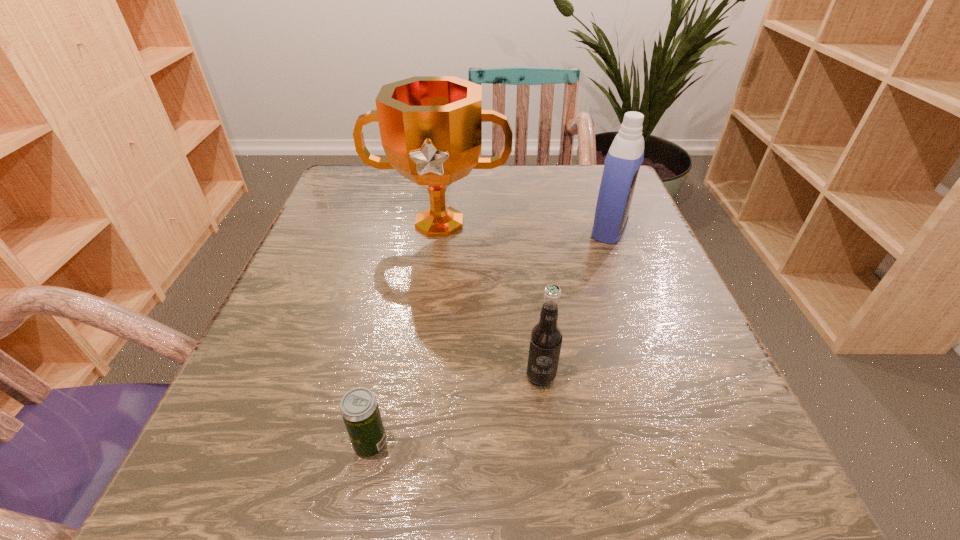
Locate an element on the screen. award is located at coordinates [431, 126].

The image size is (960, 540). Identify the location of detergent. (625, 156).

You are a GUI agent. You are given a task and a screenshot of the screen. Output one action in this format:
    pyautogui.click(x=<x>, y=<y>)
    Task: Click on the third object from left to right
    
    Given the screenshot: What is the action you would take?
    pyautogui.click(x=545, y=342)

Find the location of a particular element. This screenshot has height=540, width=960. the second shortest object is located at coordinates (545, 342).

Locate an element on the screen. The image size is (960, 540). the nearest object is located at coordinates (359, 408).

Where is `the shortest object`? the shortest object is located at coordinates (359, 408).

This screenshot has height=540, width=960. In order to click on free space located 0.360m on the side of the award with the star emblem in this screenshot , I will do (417, 409).

Find the location of a particular element. This screenshot has height=540, width=960. free space located on the front of the detergent is located at coordinates (624, 269).

This screenshot has height=540, width=960. In order to click on free space located on the label of the root beer in this screenshot , I will do `click(549, 449)`.

Locate an element on the screen. The width and height of the screenshot is (960, 540). free space located on the right of the shortest object is located at coordinates (441, 444).